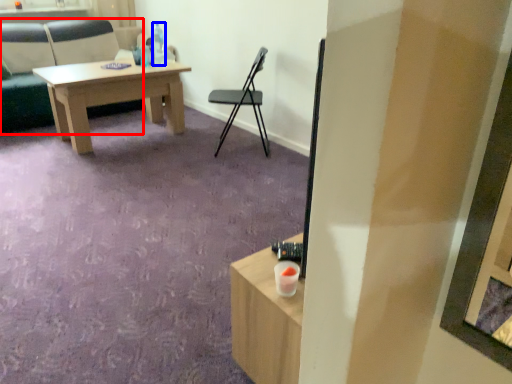
Question: Which object appears farthest to the camera in this image, chair (highlighted by a red box) or bottle (highlighted by a blue box)?

Choices:
 (A) chair
 (B) bottle

Answer: (B)